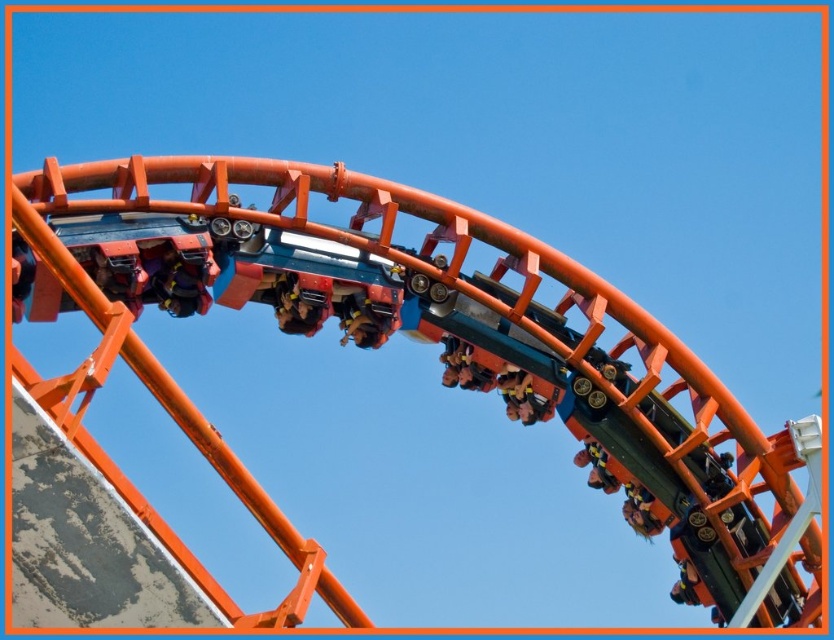
You are standing on the ground looking up at the roller coaster. Which object is nearer to you between the metallic roller coaster at center and the metallic orange roller coaster car at center?

The metallic roller coaster at center is closer to the viewer than the metallic orange roller coaster car at center.

You are standing at the point with coordinates [358,348] in the roller coaster scene. What object are you directly at?

The point at coordinates [358,348] is directly at the metallic roller coaster at center.

You are standing on the ground looking up at the metallic roller coaster at center and the metallic orange roller coaster car at center. Which object is more to the left?

The metallic roller coaster at center is more to the left because it is positioned on the left side of the metallic orange roller coaster car at center.